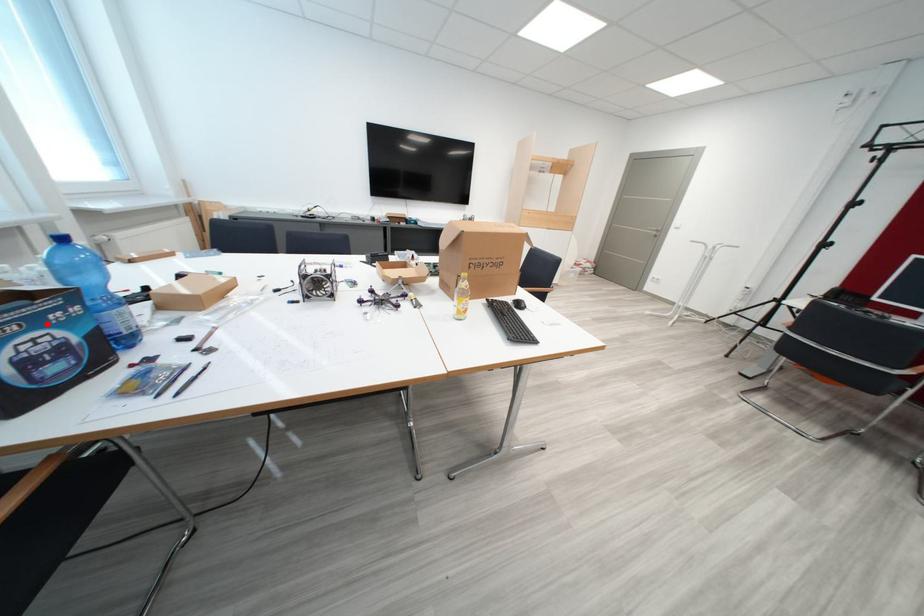
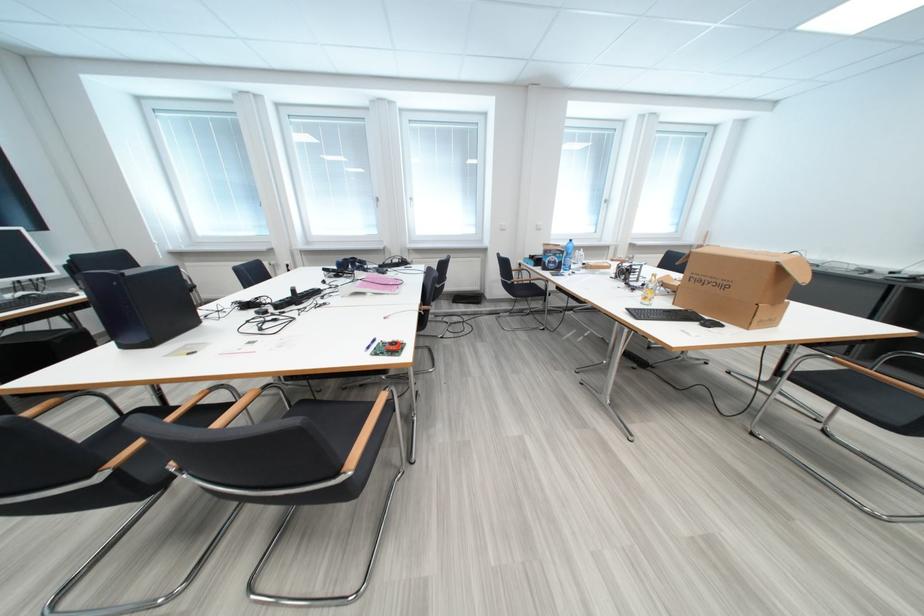
Locate, in the second image, the point that corresponds to the highlighted location in the first image.

(565, 257)